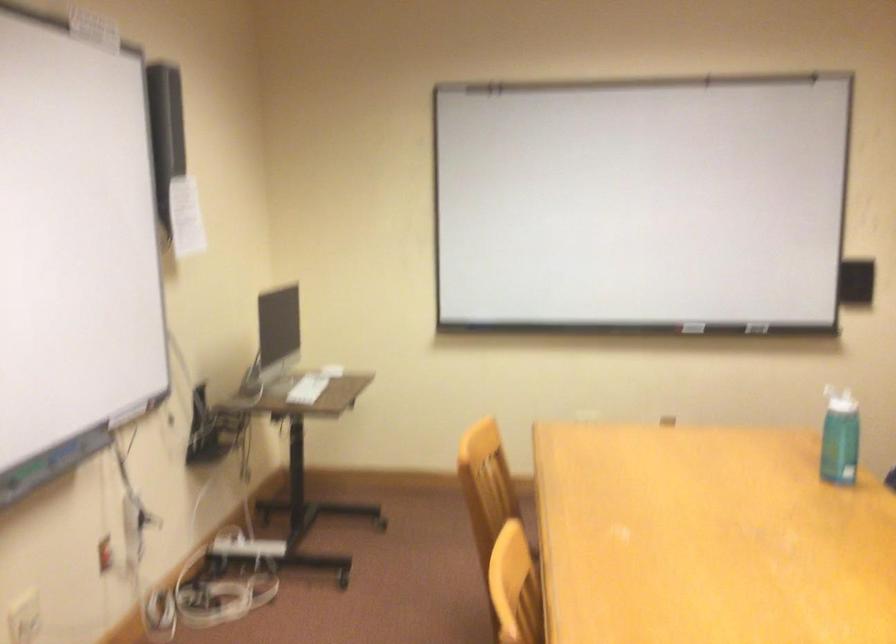
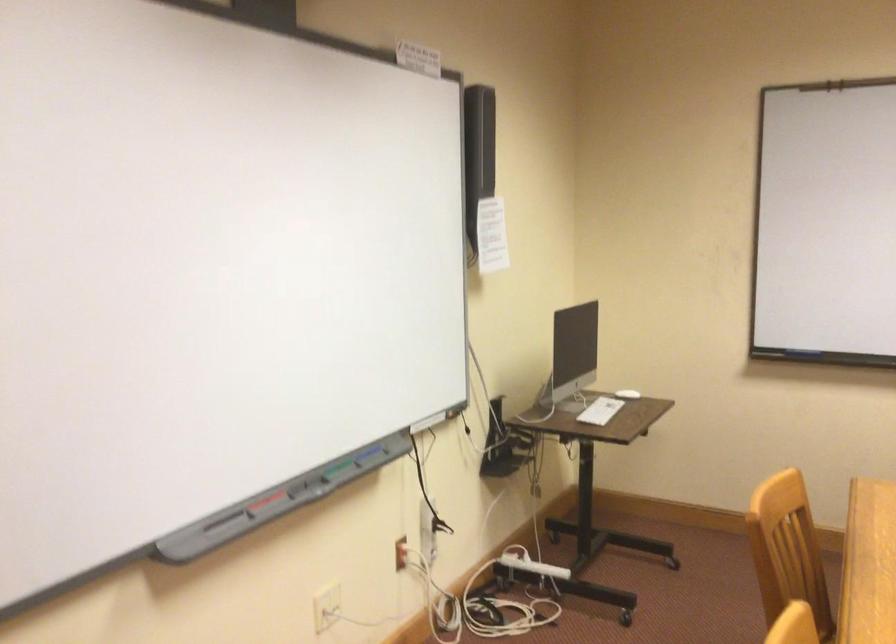
Locate, in the second image, the point that corresponds to pixel 319 390 in the first image.

(600, 410)